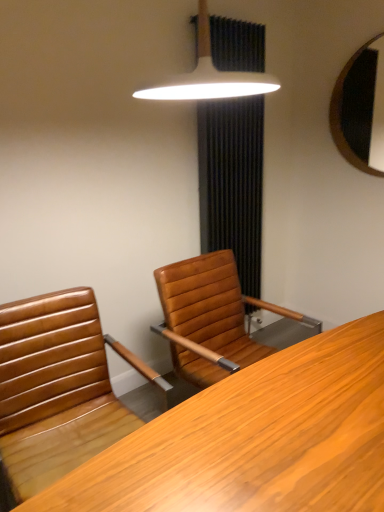
Question: Considering the positions of wooden mirror at upper right and white glossy lampshade at upper center in the image, is wooden mirror at upper right wider or thinner than white glossy lampshade at upper center?

Choices:
 (A) wide
 (B) thin

Answer: (B)

Question: Choose the correct answer: Is wooden mirror at upper right inside white glossy lampshade at upper center or outside it?

Choices:
 (A) inside
 (B) outside

Answer: (B)

Question: Which of these objects is positioned farthest from the black fabric curtain at upper center?

Choices:
 (A) white glossy lampshade at upper center
 (B) brown leather chair at center
 (C) wooden mirror at upper right
 (D) wooden desk at center

Answer: (D)

Question: Which object is positioned farthest from the wooden mirror at upper right?

Choices:
 (A) brown leather chair at center
 (B) black fabric curtain at upper center
 (C) white glossy lampshade at upper center
 (D) wooden desk at center

Answer: (A)